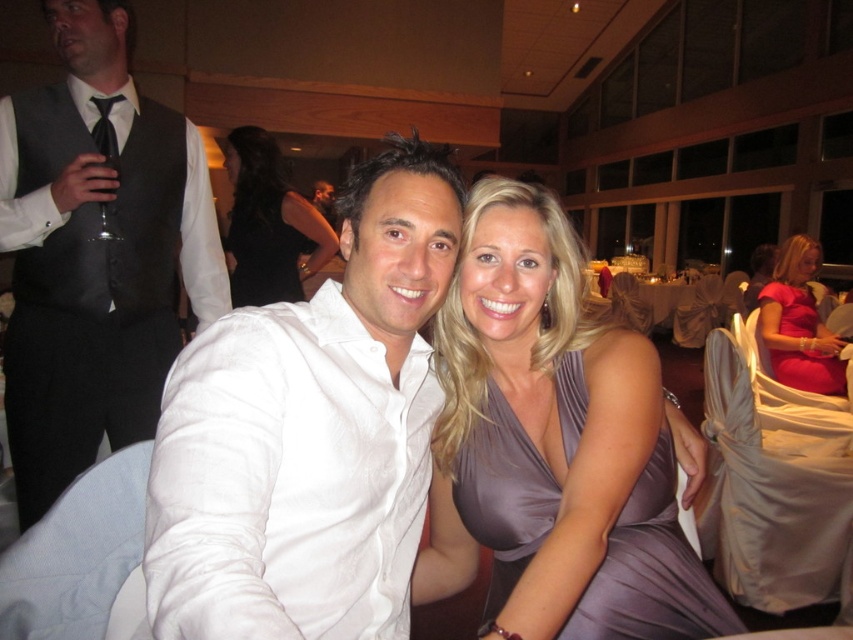
You are a photographer at the event and need to adjust the camera focus. Since the matte black vest at left and the black satin dress at center are both in the frame, which one requires a wider focus area due to its size?

The matte black vest at left requires a wider focus area because its width is larger than the black satin dress at center.

In the scene shown: You are a photographer at the event and want to capture a photo that includes both the matte black vest at left and the black satin dress at center. The camera has a maximum focus range of 1 meter. Will you be able to include both in the same frame without moving the camera?

The matte black vest at left and the black satin dress at center are 94.83 centimeters apart. Since 94.83 cm is less than 1 meter, the camera can focus on both objects within its maximum range, so yes, you can include both in the same frame without moving the camera.

You are standing in the reception hall and want to move from point A to point B. Point A is at coordinates point (253, 285) and point B is at coordinates point (265, 204). Which point is closer to you?

Point (253, 285) is closer to you because it is further to the viewer than point (265, 204).